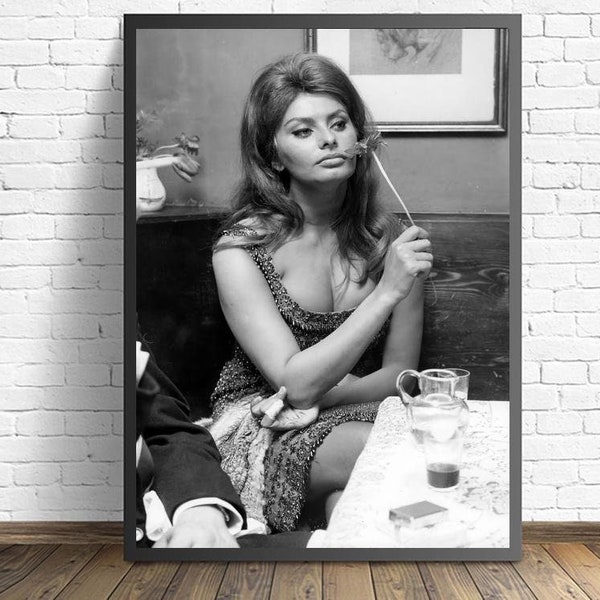
Locate an element on the screen. The image size is (600, 600). frame is located at coordinates (492, 129).